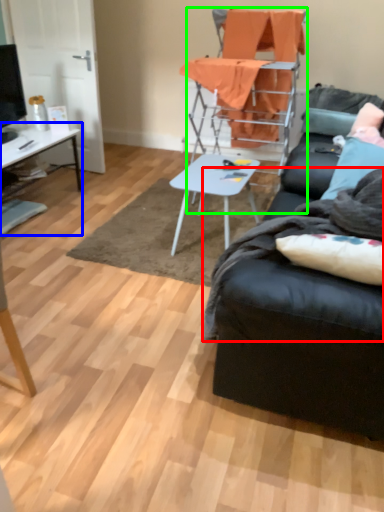
Question: Considering the real-world distances, which object is farthest from blanket (highlighted by a red box)? desk (highlighted by a blue box) or chair (highlighted by a green box)?

Choices:
 (A) desk
 (B) chair

Answer: (A)